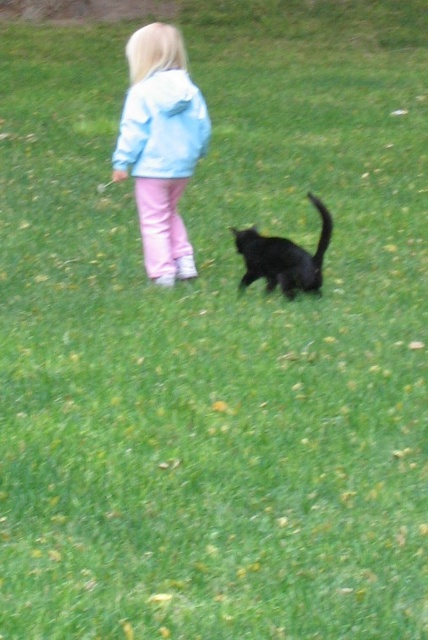
Question: Does light blue fleece jacket at upper center appear on the right side of shiny black cat at center?

Choices:
 (A) no
 (B) yes

Answer: (A)

Question: Is light blue fleece jacket at upper center to the right of shiny black cat at center from the viewer's perspective?

Choices:
 (A) no
 (B) yes

Answer: (A)

Question: Which object is farther from the camera taking this photo?

Choices:
 (A) light blue fleece jacket at upper left
 (B) light blue fleece jacket at upper center

Answer: (A)

Question: Can you confirm if light blue fleece jacket at upper left is smaller than light blue fleece jacket at upper center?

Choices:
 (A) no
 (B) yes

Answer: (A)

Question: Among these objects, which one is farthest from the camera?

Choices:
 (A) light blue fleece jacket at upper left
 (B) shiny black cat at center

Answer: (A)

Question: Which point is farther to the camera?

Choices:
 (A) light blue fleece jacket at upper center
 (B) light blue fleece jacket at upper left

Answer: (B)